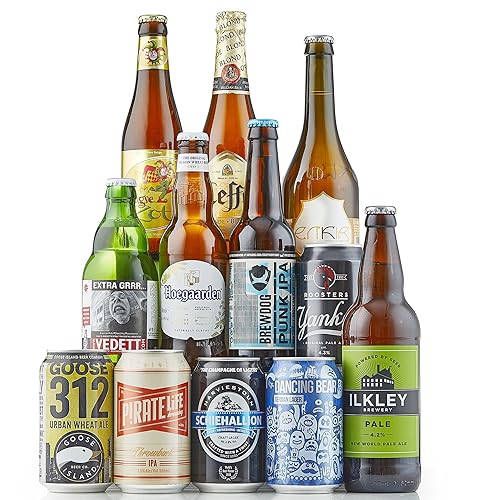
Locate an element on the screen. bottles is located at coordinates (371, 386), (313, 164), (262, 178), (232, 71), (153, 85), (193, 181), (129, 244).